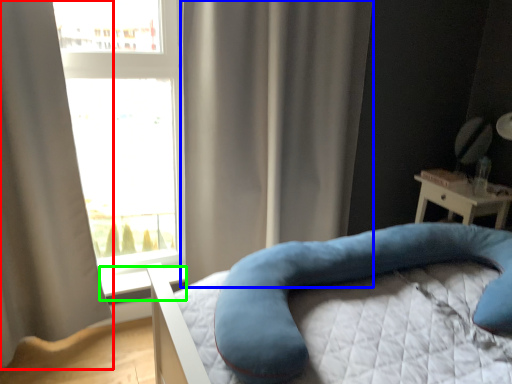
Question: Which is nearer to the curtain (highlighted by a red box)? curtain (highlighted by a blue box) or window sill (highlighted by a green box).

Choices:
 (A) curtain
 (B) window sill

Answer: (B)